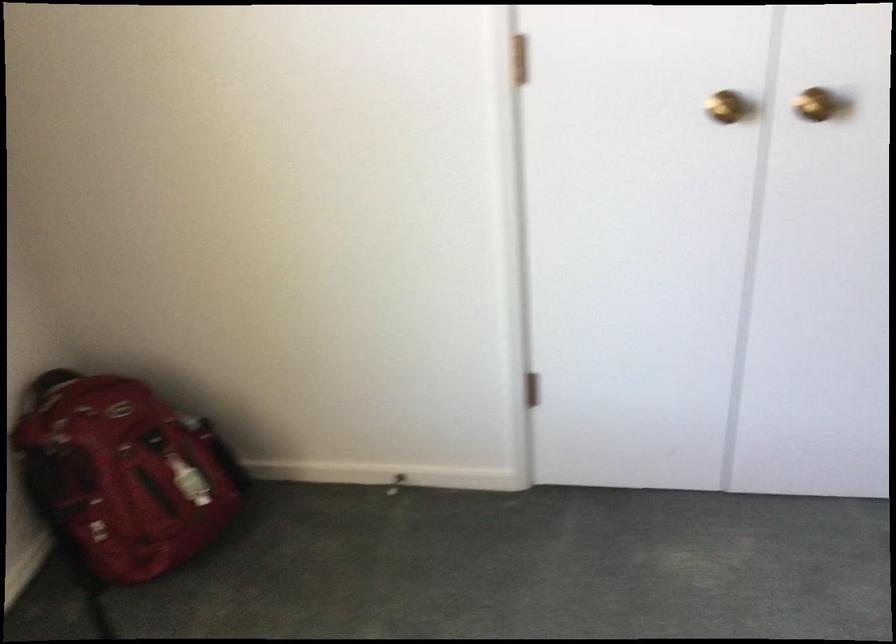
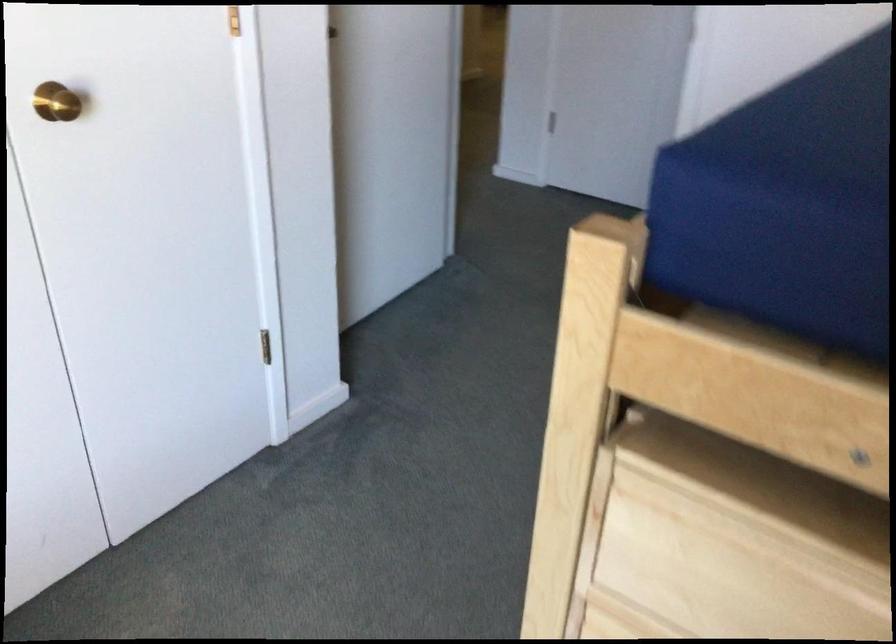
The point at (814, 98) is marked in the first image. Where is the corresponding point in the second image?

(56, 102)